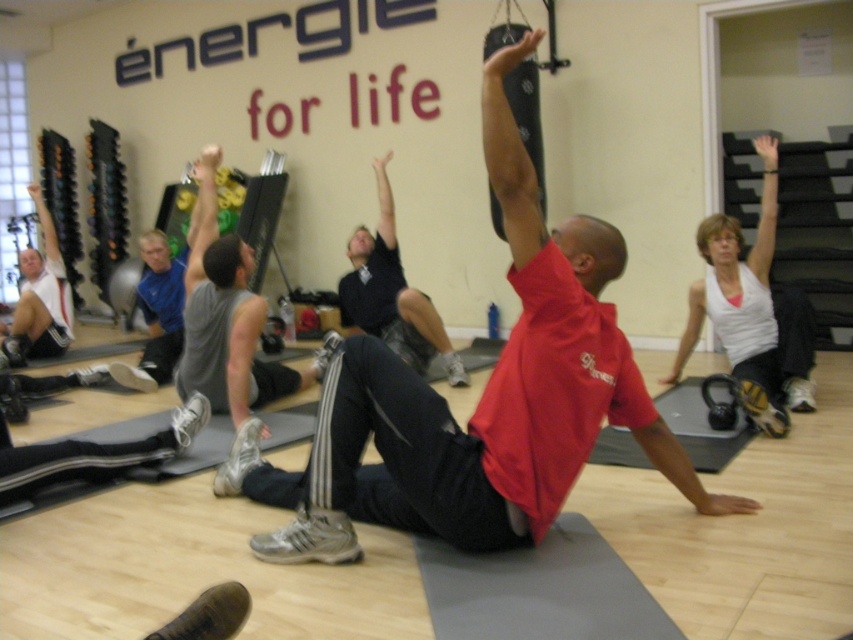
Question: In this image, where is red matte shirt at center located relative to white matte tank top at left?

Choices:
 (A) above
 (B) below

Answer: (B)

Question: Which of the following is the closest to the observer?

Choices:
 (A) dark blue shirt at center
 (B) red matte shirt at center
 (C) white matte tank top at left
 (D) white matte tank top at upper right

Answer: (B)

Question: Which is nearer to the white matte tank top at left?

Choices:
 (A) white matte tank top at upper right
 (B) red matte shirt at center

Answer: (B)

Question: Estimate the real-world distances between objects in this image. Which object is farther from the white matte tank top at left?

Choices:
 (A) dark blue shirt at center
 (B) red matte shirt at center

Answer: (B)

Question: Is red matte shirt at center smaller than white matte tank top at left?

Choices:
 (A) no
 (B) yes

Answer: (A)

Question: Is red matte shirt at center closer to camera compared to white matte tank top at upper right?

Choices:
 (A) yes
 (B) no

Answer: (A)